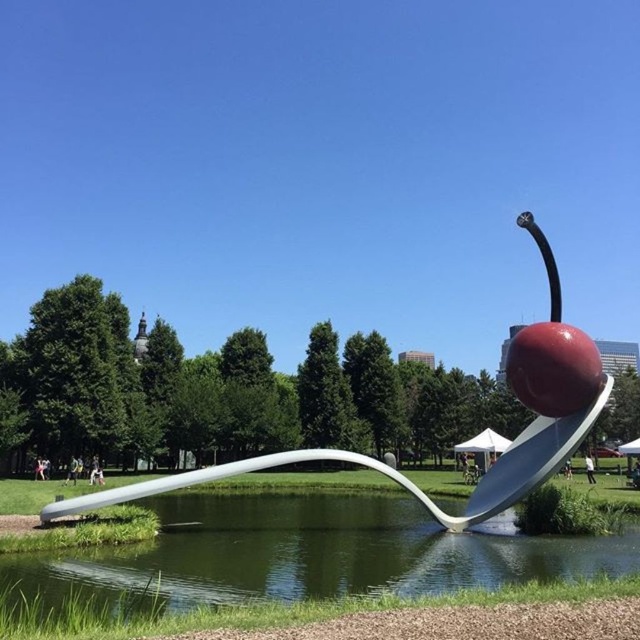
You are an artist planning to paint the sculpture from the scene. You need to know which object is taller between the clear water at spoon right and the white glossy spoon at center. Which one is taller?

The white glossy spoon at center is taller than clear water at spoon right.

You are a visitor standing at the edge of the water, looking at the sculpture. Can you see the white glossy spoon at center through the clear water at spoon right?

The clear water at spoon right is positioned over the white glossy spoon at center, so yes, you can see the white glossy spoon at center through the clear water at spoon right.